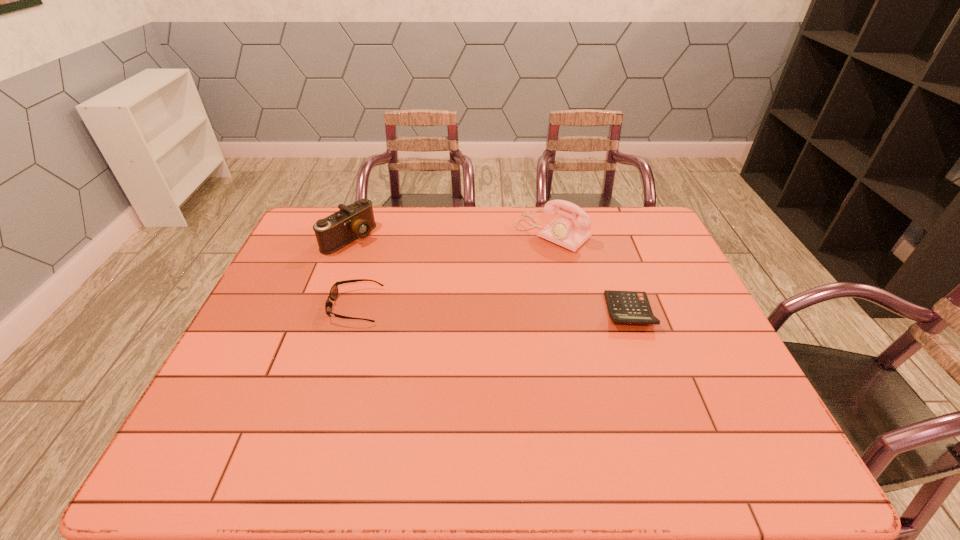
Locate an element on the screen. vacant region located 0.390m on the dial of the tallest object is located at coordinates (453, 316).

The image size is (960, 540). I want to click on vacant space situated 0.300m on the lens of the second tallest object, so click(x=434, y=286).

I want to click on vacant space located 0.210m on the lens of the second tallest object, so click(412, 274).

Identify the location of free space located on the lens of the second tallest object. Image resolution: width=960 pixels, height=540 pixels. (397, 266).

At what (x,y) coordinates should I click in order to perform the action: click on telephone located at the far edge. Please return your answer as a coordinate pair (x, y). Looking at the image, I should click on (569, 233).

The height and width of the screenshot is (540, 960). I want to click on camera situated at the far edge, so click(x=356, y=220).

Image resolution: width=960 pixels, height=540 pixels. I want to click on object present at the left edge, so click(356, 220).

Where is `object located at the right edge`? This screenshot has height=540, width=960. object located at the right edge is located at coordinates (633, 307).

Identify the location of object at the far left corner. click(x=356, y=220).

Locate an element on the screen. free spot at the far edge of the desktop is located at coordinates (402, 214).